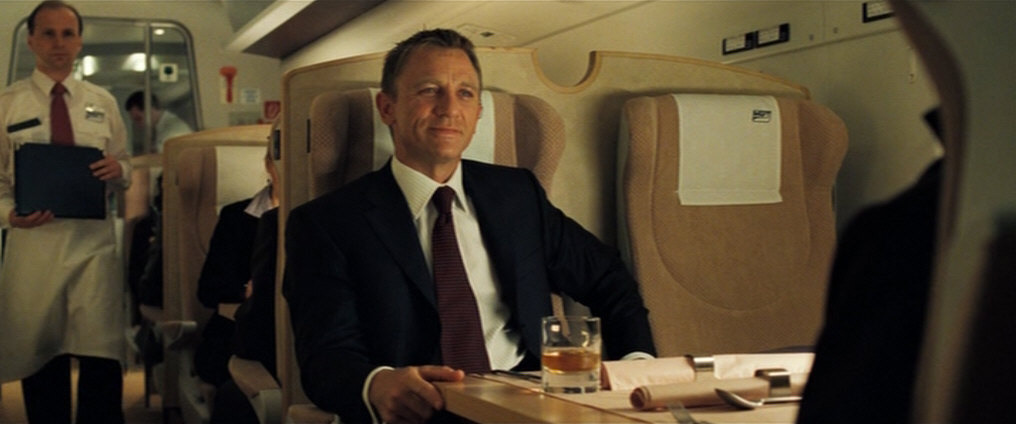
The width and height of the screenshot is (1016, 424). In order to click on spoon in this screenshot , I will do `click(733, 393)`.